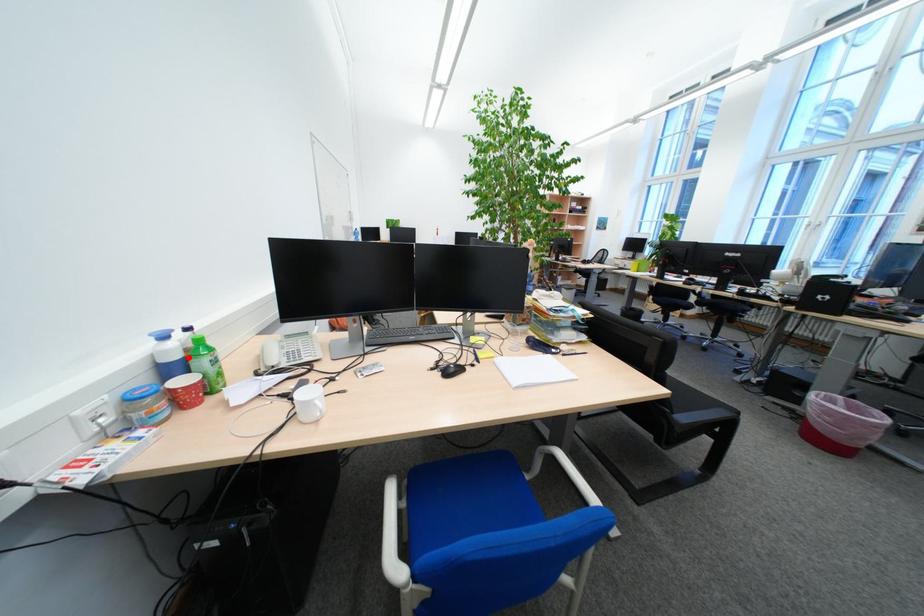
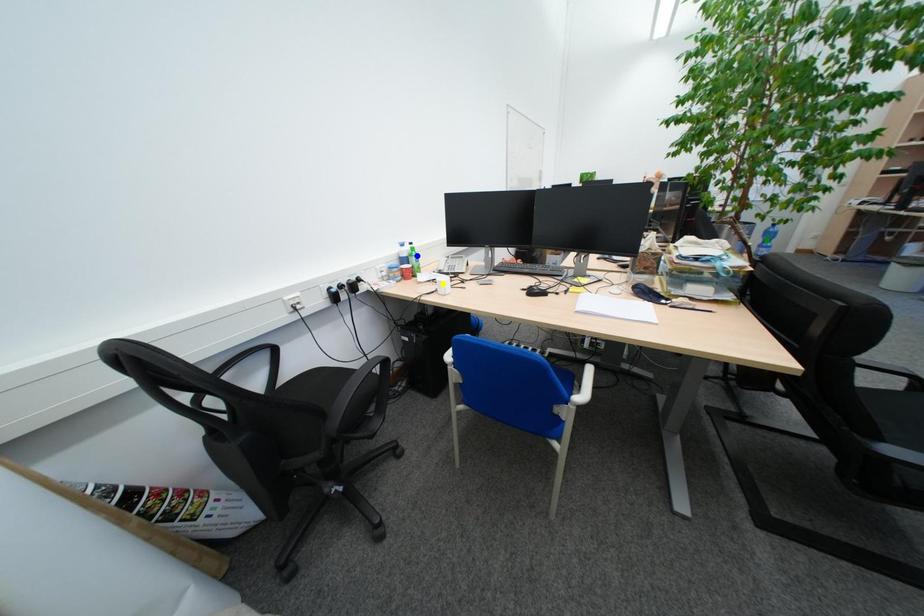
Question: I am providing you with two images of the same scene from different viewpoints. A red point is marked on the first image. You are given multiple points on the second image. Which spot in image 2 lines up with the point in image 1?

Choices:
 (A) green point
 (B) blue point
 (C) yellow point

Answer: (B)